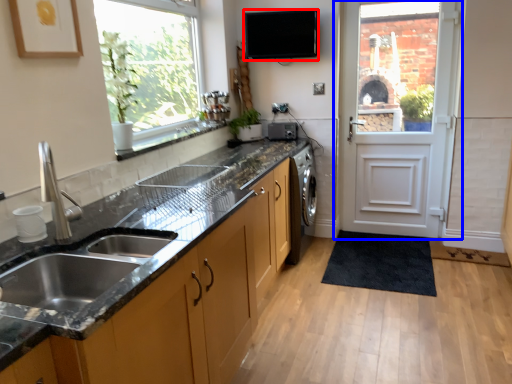
Question: Which object is further to the camera taking this photo, appliance (highlighted by a red box) or door (highlighted by a blue box)?

Choices:
 (A) appliance
 (B) door

Answer: (A)